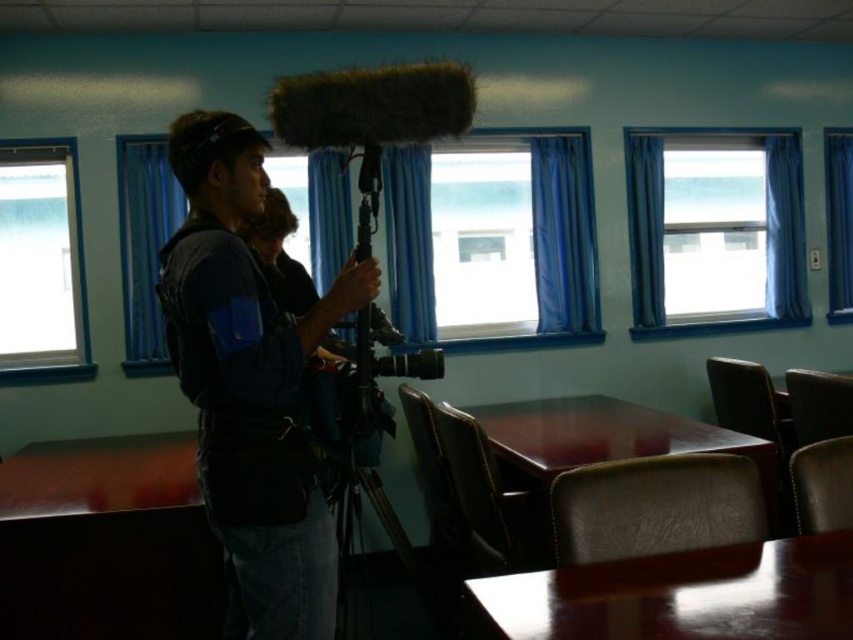
Is transparent glass window at left behind black matte tripod at center?

Yes, transparent glass window at left is behind black matte tripod at center.

Between point (19, 275) and point (389, 529), which one is positioned in front?

Point (389, 529) is more forward.

Find the location of a particular element. Image resolution: width=853 pixels, height=640 pixels. transparent glass window at left is located at coordinates (41, 264).

Consider the image. Is blue curtain at upper right to the right of black matte tripod at center from the viewer's perspective?

Indeed, blue curtain at upper right is positioned on the right side of black matte tripod at center.

Which is more to the left, blue curtain at upper right or black matte tripod at center?

From the viewer's perspective, black matte tripod at center appears more on the left side.

Between point (633, 224) and point (350, 422), which one is positioned behind?

The point (633, 224) is behind.

I want to click on blue curtain at upper right, so click(764, 234).

Does transparent glass window at left appear under blue curtain at upper right?

Indeed, transparent glass window at left is positioned under blue curtain at upper right.

From the picture: Which of these two, transparent glass window at left or blue curtain at upper right, stands taller?

Standing taller between the two is blue curtain at upper right.

This screenshot has height=640, width=853. Find the location of `transparent glass window at left`. transparent glass window at left is located at coordinates (41, 264).

Locate an element on the screen. This screenshot has height=640, width=853. transparent glass window at left is located at coordinates (41, 264).